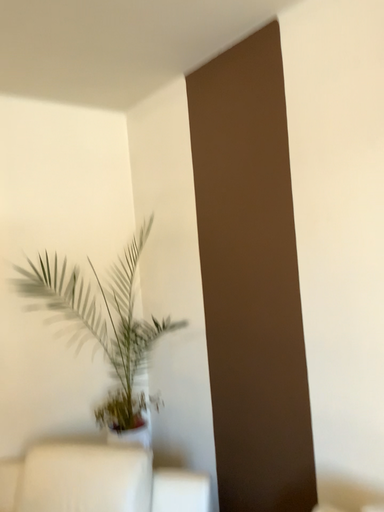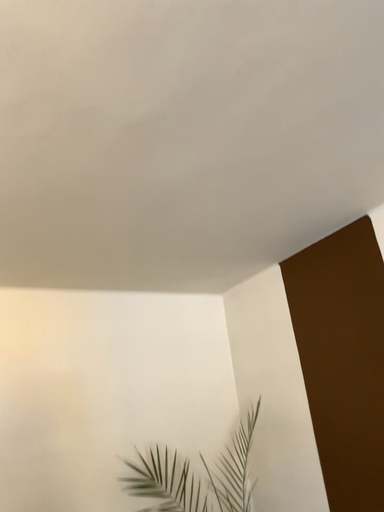
Question: How did the camera likely rotate when shooting the video?

Choices:
 (A) rotated downward
 (B) rotated upward

Answer: (B)